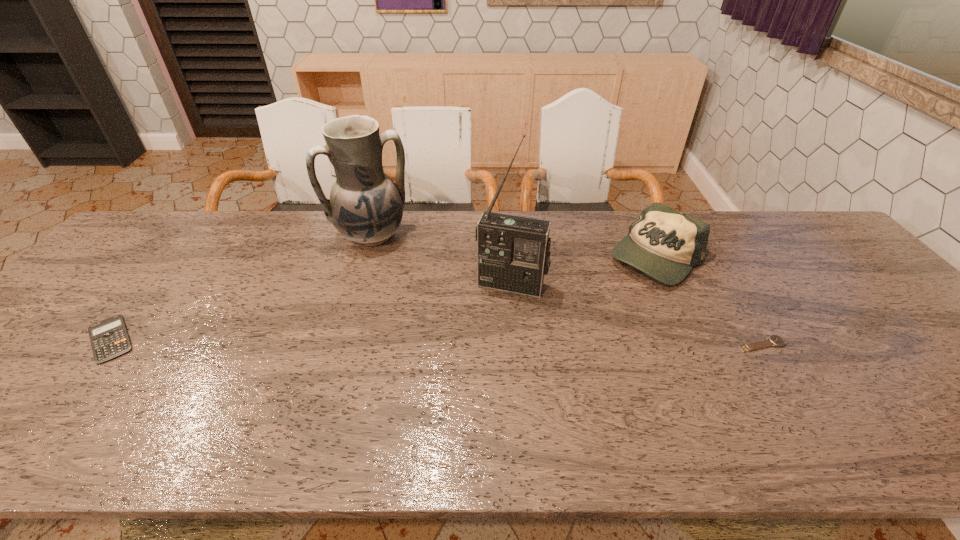
The image size is (960, 540). I want to click on vacant space located 0.190m on the front-facing side of the third tallest object, so click(x=579, y=306).

Identify the location of vacant space located 0.150m on the display of the radio receiver. The height and width of the screenshot is (540, 960). (489, 338).

Locate an element on the screen. This screenshot has height=540, width=960. free space located on the display of the radio receiver is located at coordinates (486, 347).

You are a GUI agent. You are given a task and a screenshot of the screen. Output one action in this format:
    pyautogui.click(x=<x>, y=<y>)
    Task: Click on the free spot located 0.140m on the display of the radio receiver
    The image size is (960, 540).
    Given the screenshot: What is the action you would take?
    pyautogui.click(x=490, y=335)

I want to click on blank area located 0.080m on the front-facing side of the second tallest object, so (396, 268).

Find the location of a particular element. free region located 0.400m on the front-facing side of the second tallest object is located at coordinates (444, 342).

Locate an element on the screen. The width and height of the screenshot is (960, 540). free location located 0.080m on the front-facing side of the second tallest object is located at coordinates (396, 268).

Locate an element on the screen. The image size is (960, 540). baseball cap situated at the far edge is located at coordinates (665, 244).

This screenshot has height=540, width=960. I want to click on pitcher present at the far edge, so click(x=365, y=206).

Image resolution: width=960 pixels, height=540 pixels. What are the coordinates of `object present at the left edge` in the screenshot? It's located at (109, 338).